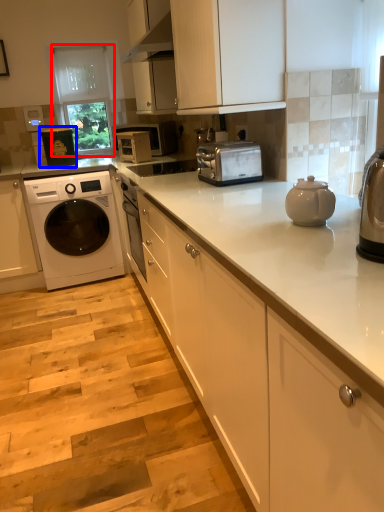
Question: Which of the following is the farthest to the observer, glass door (highlighted by a red box) or appliance (highlighted by a blue box)?

Choices:
 (A) glass door
 (B) appliance

Answer: (A)